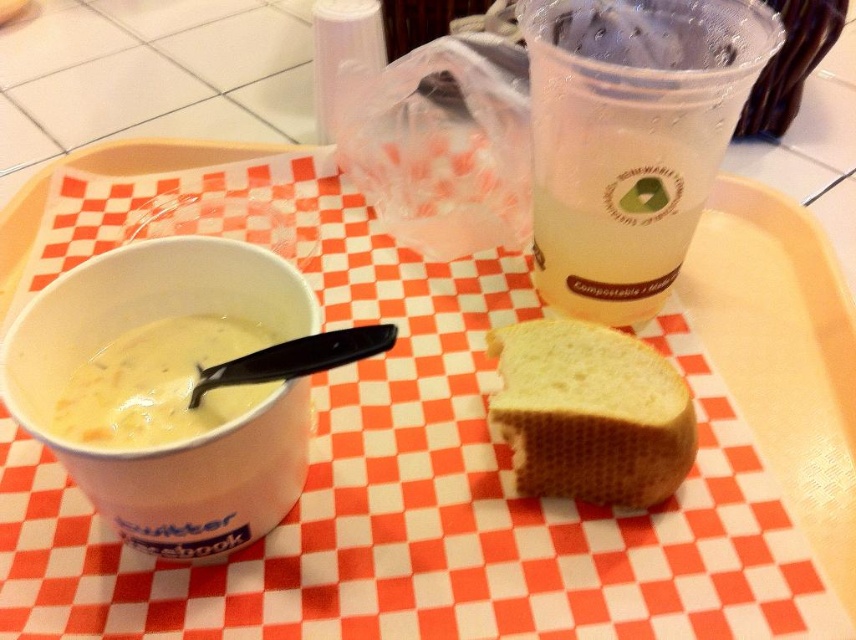
Question: Does clear plastic cup at upper right appear on the right side of golden brown crusty bread at center?

Choices:
 (A) yes
 (B) no

Answer: (A)

Question: Is clear plastic cup at upper right smaller than golden brown crusty bread at center?

Choices:
 (A) yes
 (B) no

Answer: (B)

Question: Which object is closer to the camera taking this photo?

Choices:
 (A) golden brown crusty bread at center
 (B) white creamy soup at left
 (C) clear plastic cup at upper right

Answer: (C)

Question: Which of the following is the closest to the observer?

Choices:
 (A) click(x=617, y=275)
 (B) click(x=526, y=378)
 (C) click(x=167, y=348)

Answer: (B)

Question: Does clear plastic cup at upper right appear on the left side of golden brown crusty bread at center?

Choices:
 (A) yes
 (B) no

Answer: (B)

Question: Based on their relative distances, which object is farther from the clear plastic cup at upper right?

Choices:
 (A) white creamy soup at left
 (B) golden brown crusty bread at center

Answer: (A)